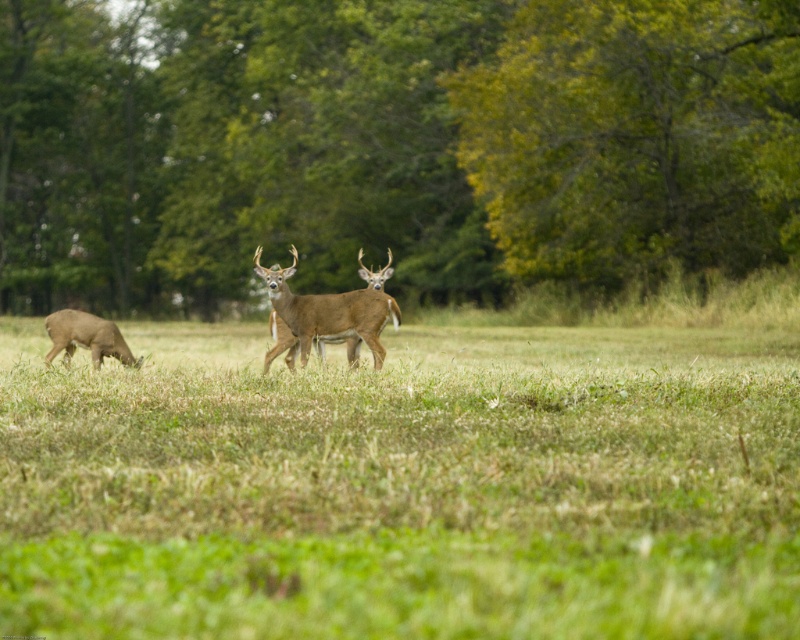
Question: Is green grass at center closer to the viewer compared to brown velvet deer at center?

Choices:
 (A) yes
 (B) no

Answer: (A)

Question: Does brown velvet deer at center have a larger size compared to brown fur deer at left?

Choices:
 (A) yes
 (B) no

Answer: (B)

Question: Which object appears closest to the camera in this image?

Choices:
 (A) green grass at center
 (B) brown velvet deer at center

Answer: (A)

Question: Does green grass at center have a smaller size compared to brown velvet deer at center?

Choices:
 (A) yes
 (B) no

Answer: (B)

Question: Which is nearer to the green grass at center?

Choices:
 (A) brown velvet deer at center
 (B) brown fur deer at left

Answer: (A)

Question: Estimate the real-world distances between objects in this image. Which object is closer to the brown velvet deer at center?

Choices:
 (A) brown fur deer at left
 (B) green grass at center

Answer: (A)